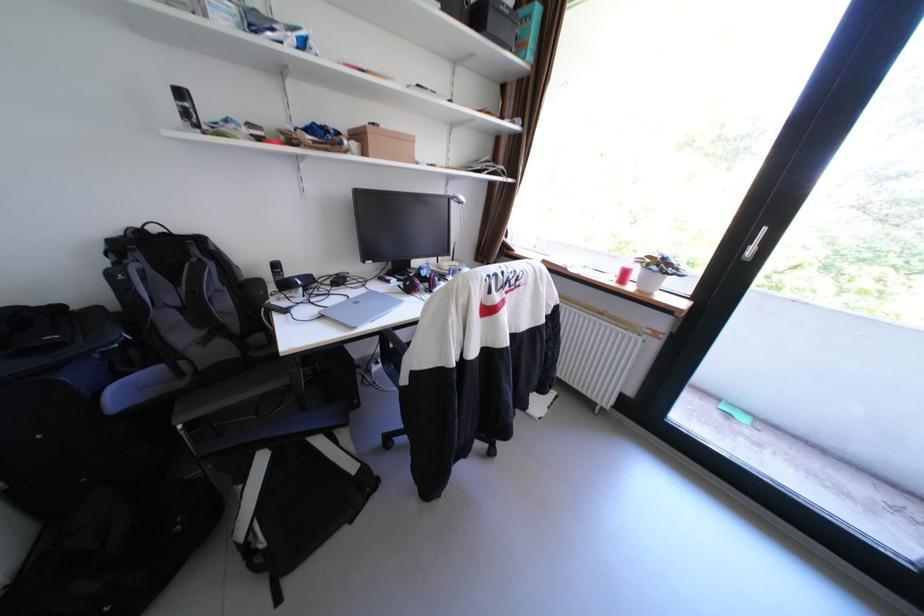
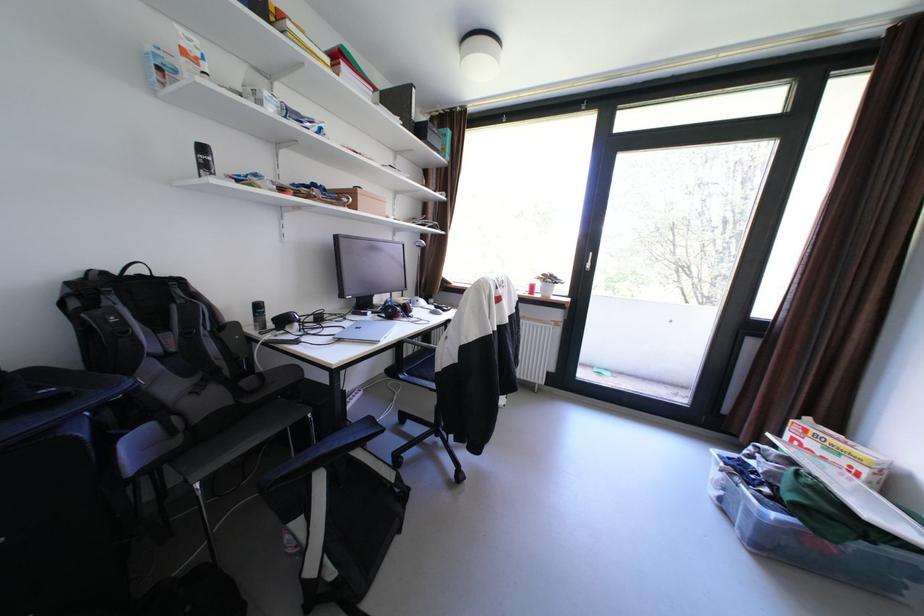
The point at (405, 281) is marked in the first image. Where is the corresponding point in the second image?

(380, 313)